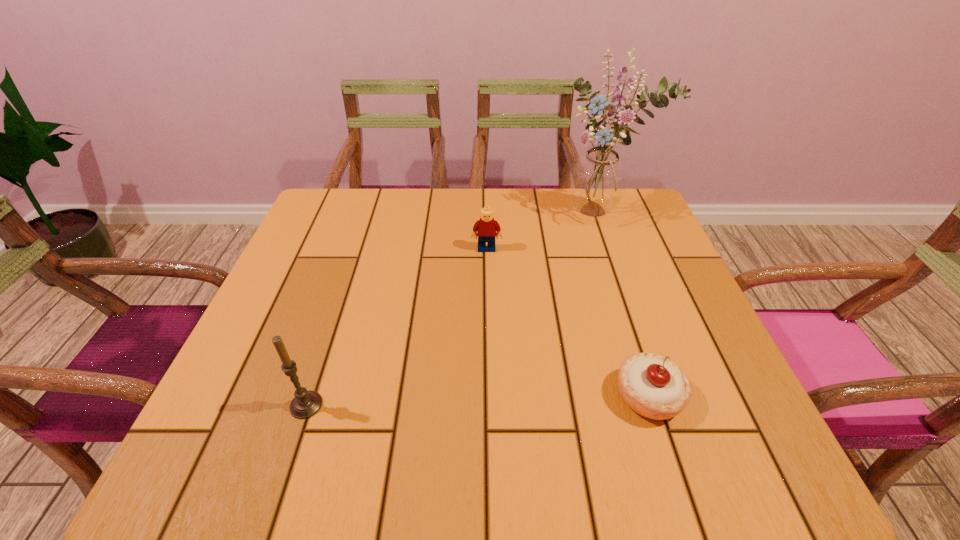
Identify the location of the third shortest object. (305, 404).

You are a GUI agent. You are given a task and a screenshot of the screen. Output one action in this format:
    pyautogui.click(x=<x>, y=<y>)
    Task: Click on the leftmost object
    This screenshot has height=540, width=960.
    Given the screenshot: What is the action you would take?
    pyautogui.click(x=305, y=404)

I want to click on the shortest object, so click(x=654, y=387).

At what (x,y) coordinates should I click in order to perform the action: click on Lego. Please return your answer as a coordinate pair (x, y). This screenshot has height=540, width=960. Looking at the image, I should click on (485, 228).

Find the location of a particular element. The image size is (960, 540). the third object from right to left is located at coordinates (485, 228).

At what (x,y) coordinates should I click in order to perform the action: click on the farthest object. Please return your answer as a coordinate pair (x, y). Looking at the image, I should click on (597, 181).

Identify the location of the tallest object. This screenshot has width=960, height=540. (597, 181).

The image size is (960, 540). Identify the location of vacant position located on the back of the candle. (325, 347).

Locate an element on the screen. Image resolution: width=960 pixels, height=540 pixels. free location located on the back of the shortest object is located at coordinates (597, 238).

Find the location of a particular element. free space located 0.290m on the front-facing side of the third object from right to left is located at coordinates (489, 346).